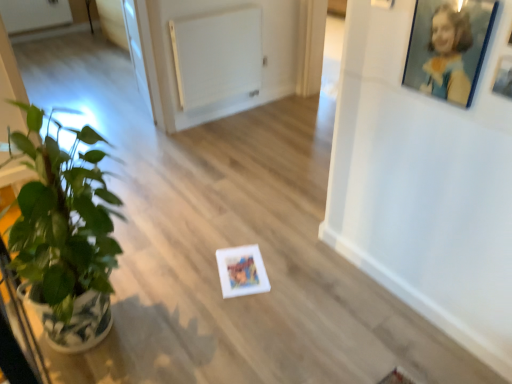
Question: From the image's perspective, is transparent glass door at upper left above or below blue glossy picture frame at upper right, the second picture frame when ordered from right to left?

Choices:
 (A) above
 (B) below

Answer: (A)

Question: From a real-world perspective, is transparent glass door at upper left above or below blue glossy picture frame at upper right, the second picture frame when ordered from right to left?

Choices:
 (A) above
 (B) below

Answer: (B)

Question: Which object is the closest to the green glossy houseplant at left?

Choices:
 (A) white matte picture frame at upper right, placed as the first picture frame when sorted from right to left
 (B) transparent glass door at upper left
 (C) blue glossy picture frame at upper right, the second picture frame when ordered from right to left
 (D) white matte radiator at upper center

Answer: (C)

Question: Which object is positioned closest to the white matte radiator at upper center?

Choices:
 (A) blue glossy picture frame at upper right, the second picture frame when ordered from right to left
 (B) transparent glass door at upper left
 (C) green glossy houseplant at left
 (D) white matte picture frame at upper right, placed as the first picture frame when sorted from right to left

Answer: (B)